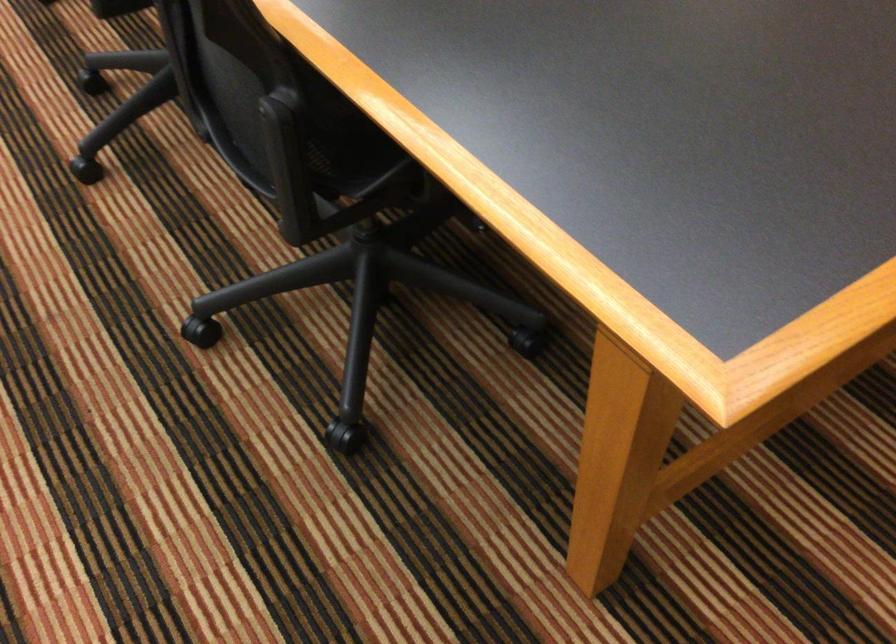
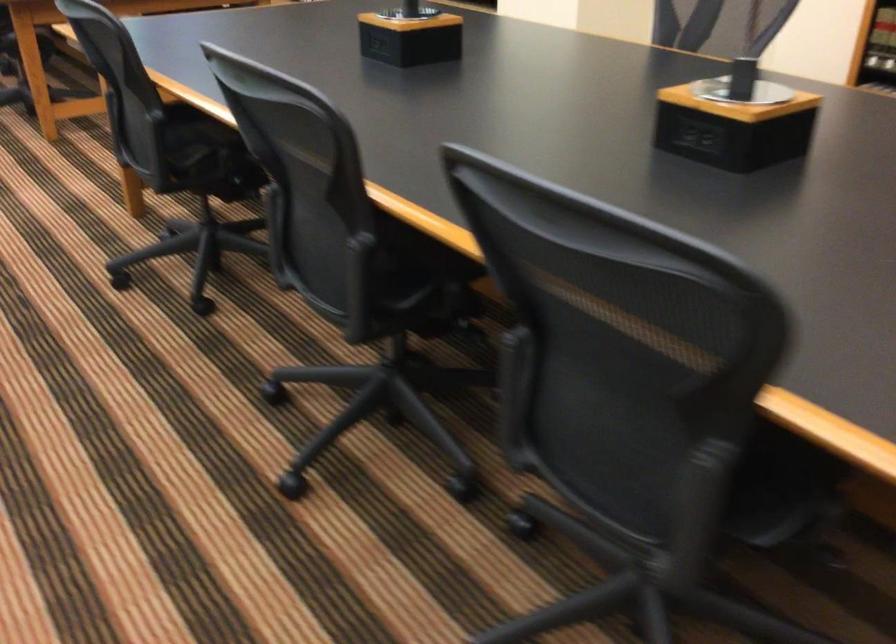
Question: How did the camera likely rotate?

Choices:
 (A) Left
 (B) Right
 (C) Up
 (D) Down

Answer: (C)